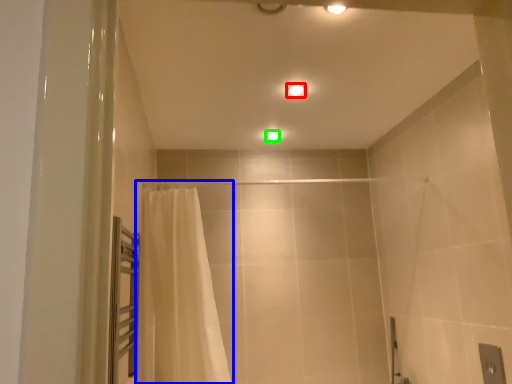
Question: Which object is positioned closest to light fixture (highlighted by a red box)? Select from curtain (highlighted by a blue box) and light fixture (highlighted by a green box).

Choices:
 (A) curtain
 (B) light fixture

Answer: (B)